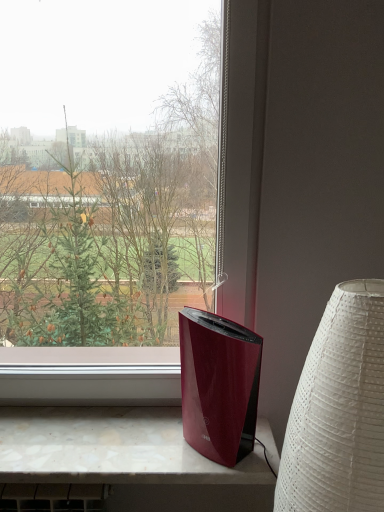
Locate an element on the screen. blank space above marble-like surface at lower center (from a real-world perspective) is located at coordinates (96, 431).